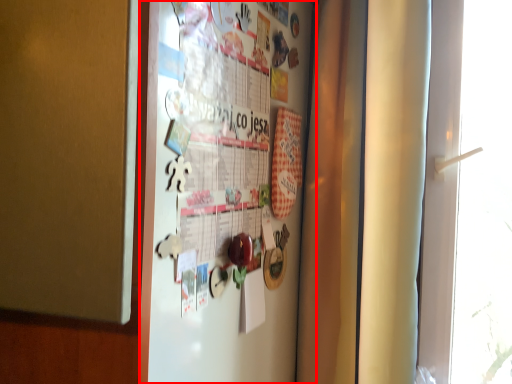
Question: In this image, where is fridge (annotated by the red box) located relative to window?

Choices:
 (A) right
 (B) left

Answer: (B)